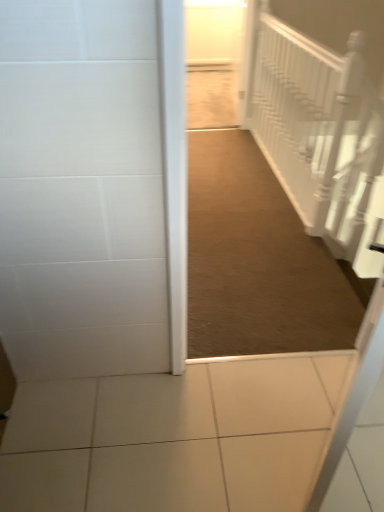
Locate an element on the screen. free space to the left of white textured stairwell at upper right is located at coordinates pyautogui.click(x=233, y=177).